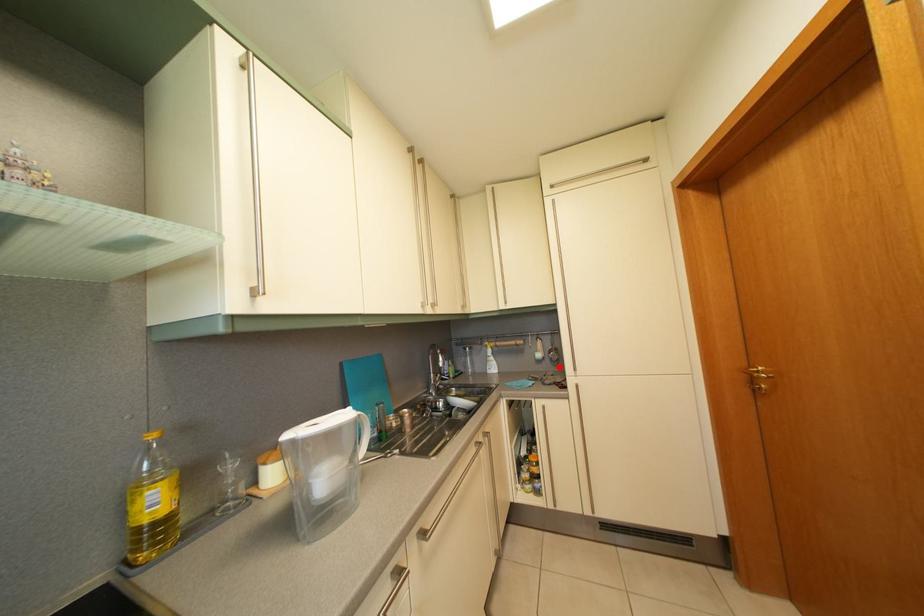
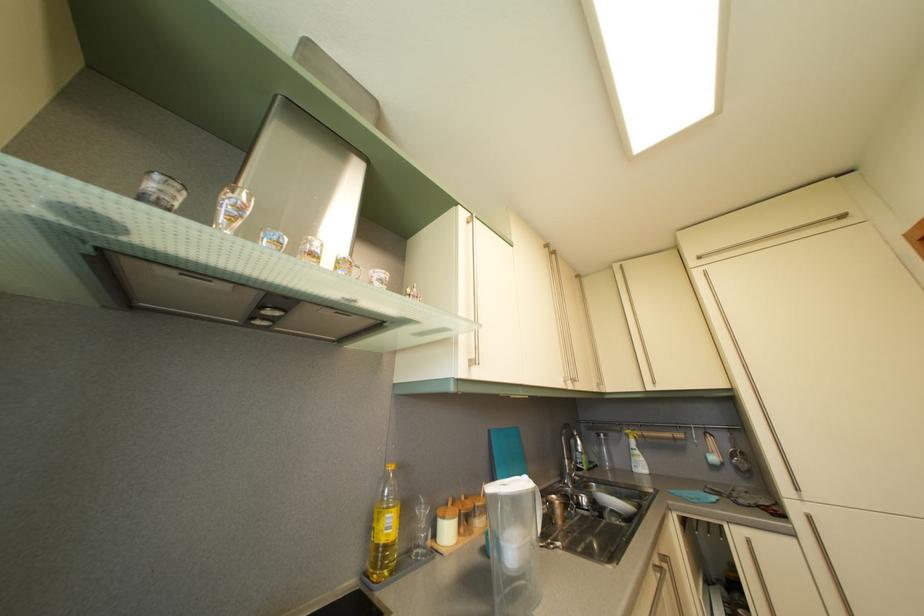
Where in the second image is the point corresponding to the highlighted location from the first image?

(746, 476)